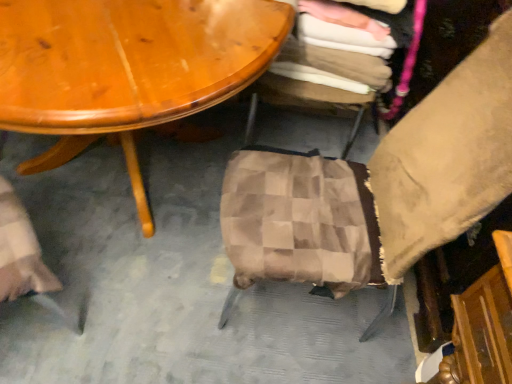
Question: Would you say checkered fabric stool at center, the second chair when ordered from front to back, is inside or outside brown checkered fabric at center, acting as the first chair starting from the front?

Choices:
 (A) outside
 (B) inside

Answer: (A)

Question: Is checkered fabric stool at center, the 1th chair viewed from the back, to the left or to the right of brown checkered fabric at center, arranged as the second chair when viewed from the back, in the image?

Choices:
 (A) right
 (B) left

Answer: (A)

Question: Considering the positions of checkered fabric stool at center, the second chair when ordered from front to back, and brown checkered fabric at center, acting as the first chair starting from the front, in the image, is checkered fabric stool at center, the second chair when ordered from front to back, wider or thinner than brown checkered fabric at center, acting as the first chair starting from the front,?

Choices:
 (A) thin
 (B) wide

Answer: (B)

Question: Considering the positions of brown checkered fabric at center, acting as the first chair starting from the front, and checkered fabric stool at center, the second chair when ordered from front to back, in the image, is brown checkered fabric at center, acting as the first chair starting from the front, bigger or smaller than checkered fabric stool at center, the second chair when ordered from front to back,?

Choices:
 (A) big
 (B) small

Answer: (A)

Question: Do you think brown checkered fabric at center, arranged as the second chair when viewed from the back, is within checkered fabric stool at center, the second chair when ordered from front to back, or outside of it?

Choices:
 (A) outside
 (B) inside

Answer: (A)

Question: Relative to checkered fabric stool at center, the 1th chair viewed from the back, is brown checkered fabric at center, acting as the first chair starting from the front, in front or behind?

Choices:
 (A) front
 (B) behind

Answer: (A)

Question: Does point (468, 69) appear closer or farther from the camera than point (338, 18)?

Choices:
 (A) closer
 (B) farther

Answer: (A)